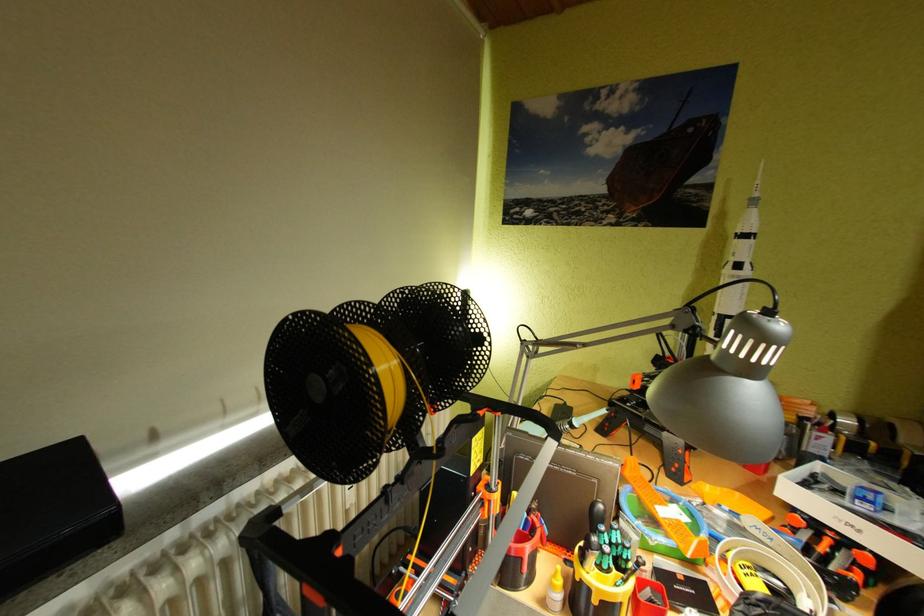
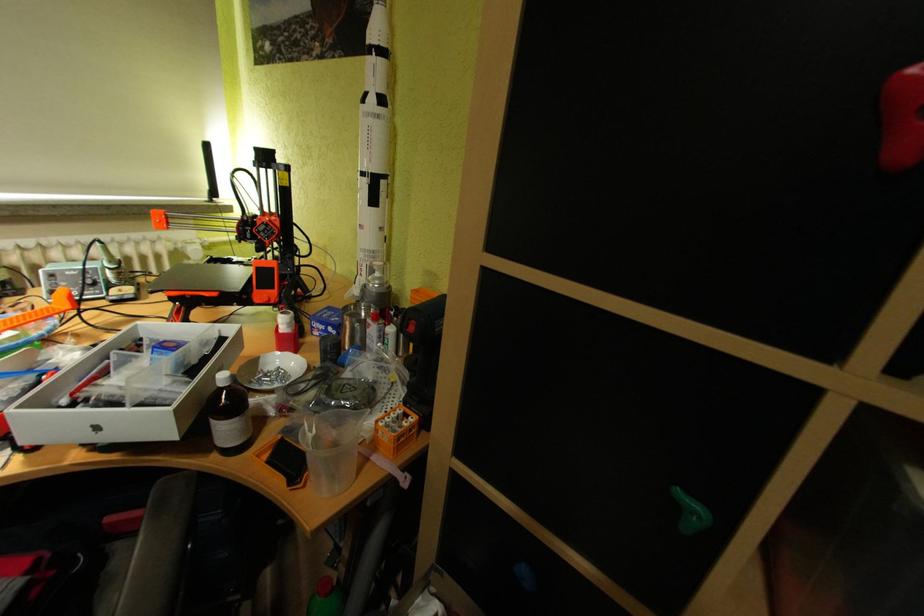
Question: What movement of the cameraman would produce the second image?

Choices:
 (A) Left
 (B) Right
 (C) Forward
 (D) Backward

Answer: (B)